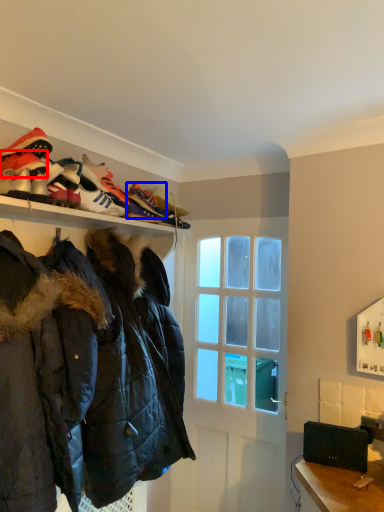
Question: Which of the following is the closest to the observer, footwear (highlighted by a red box) or shoe (highlighted by a blue box)?

Choices:
 (A) footwear
 (B) shoe

Answer: (A)